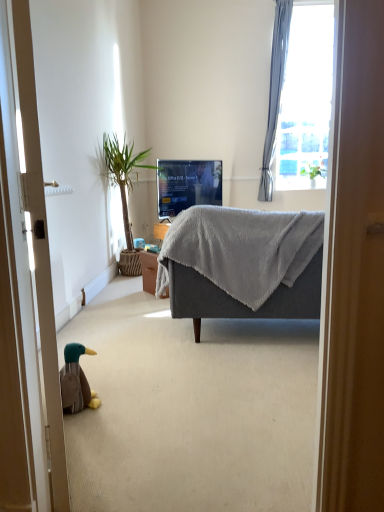
Question: Considering their positions, is matte black tv at center located in front of or behind wooden door at left?

Choices:
 (A) front
 (B) behind

Answer: (B)

Question: Is point (218, 186) closer or farther from the camera than point (28, 389)?

Choices:
 (A) closer
 (B) farther

Answer: (B)

Question: Estimate the real-world distances between objects in this image. Which object is closer to the matte black tv at center?

Choices:
 (A) gray soft fabric couch at center
 (B) green leafy plant at left
 (C) brown plush duck at lower left
 (D) green leafy plant at upper right
 (E) light blue sheer curtain at upper right

Answer: (B)

Question: Which is farther from the green leafy plant at upper right?

Choices:
 (A) light blue sheer curtain at upper right
 (B) matte black tv at center
 (C) green leafy plant at left
 (D) gray soft fabric couch at center
 (E) wooden door at left

Answer: (E)